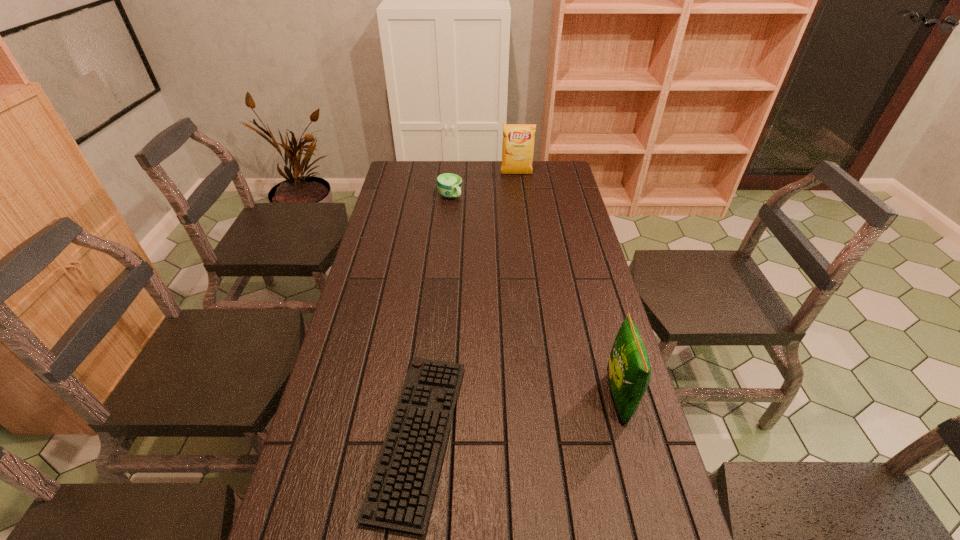
This screenshot has height=540, width=960. In order to click on free point located on the front-facing side of the rightmost object in this screenshot , I will do `click(476, 398)`.

Locate an element on the screen. blank area located on the front of the cup is located at coordinates (444, 258).

Identify the location of vacant space situated on the right of the computer keyboard. (628, 436).

What are the coordinates of `crisp (potato chip) that is at the far edge` in the screenshot? It's located at (518, 140).

I want to click on cup at the far edge, so click(x=448, y=185).

Locate an element on the screen. This screenshot has height=540, width=960. object that is at the left edge is located at coordinates (400, 494).

At what (x,y) coordinates should I click in order to perform the action: click on object present at the far right corner. Please return your answer as a coordinate pair (x, y). Looking at the image, I should click on (518, 140).

Where is `free space at the left edge`? The image size is (960, 540). free space at the left edge is located at coordinates (312, 483).

Identify the location of vacant space at the right edge of the desktop. Image resolution: width=960 pixels, height=540 pixels. (539, 209).

Find the location of a particular element. free space at the far left corner of the desktop is located at coordinates (409, 174).